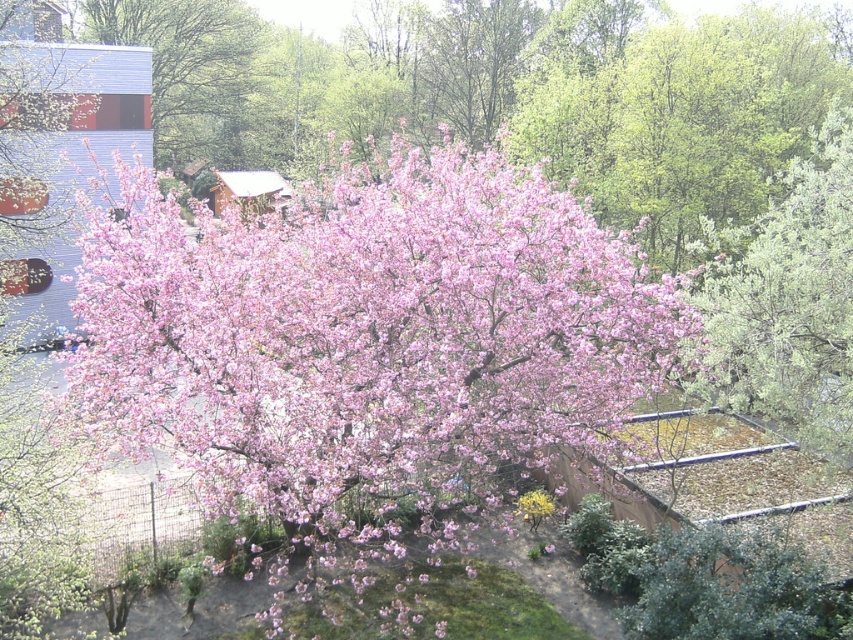
You are standing in a park and see the pink matte tree at center. If you walk straight ahead, how far will you have to go to reach the tree?

The pink matte tree at center is 46.75 feet away from you, so you will have to walk 46.75 feet straight ahead to reach it.

You are standing at the point with coordinates 0.5, 0.4 in the image. Which object from the list is closest to you? The available objects are pink matte tree at center.

The pink matte tree at center is located at point (367, 339), so it is the closest object to your current position at (340, 320).